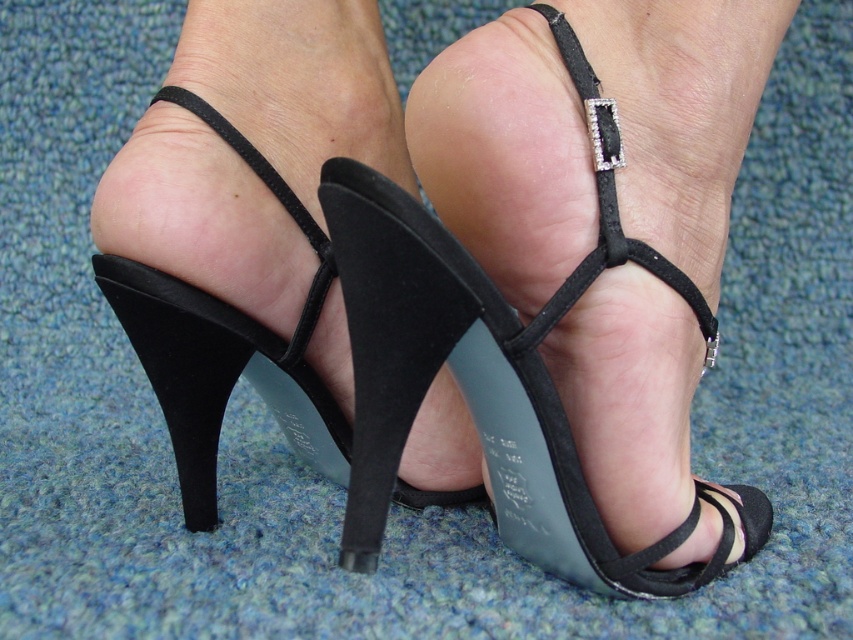
Question: Which object appears closest to the camera in this image?

Choices:
 (A) black suede heel at lower center
 (B) black suede strap at center

Answer: (A)

Question: Does black suede strap at center appear on the right side of black suede heel at lower center?

Choices:
 (A) no
 (B) yes

Answer: (B)

Question: Is black suede strap at center wider than black suede heel at lower center?

Choices:
 (A) no
 (B) yes

Answer: (B)

Question: Which of the following is the closest to the observer?

Choices:
 (A) black suede strap at center
 (B) black suede heel at lower center

Answer: (B)

Question: Is black suede strap at center above black suede heel at lower center?

Choices:
 (A) no
 (B) yes

Answer: (B)